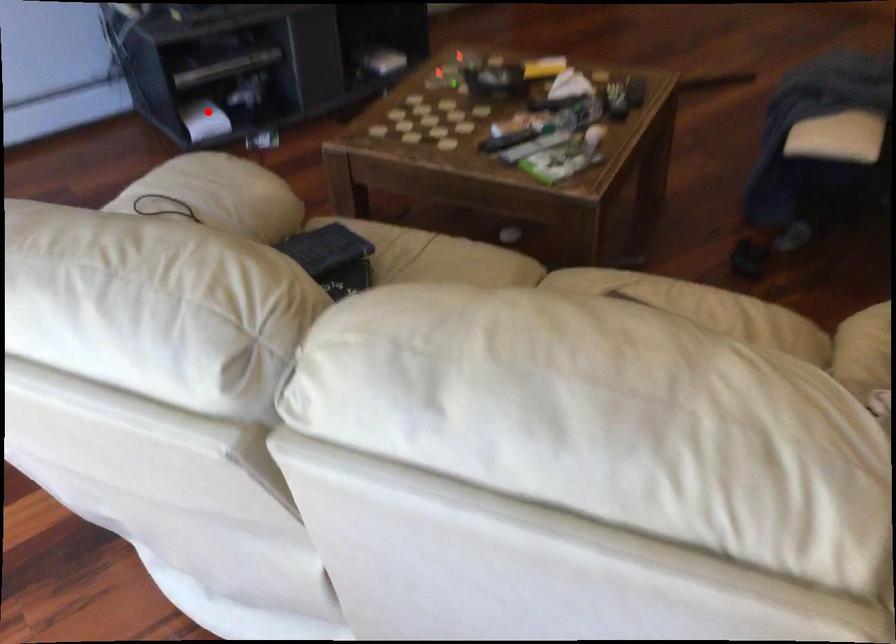
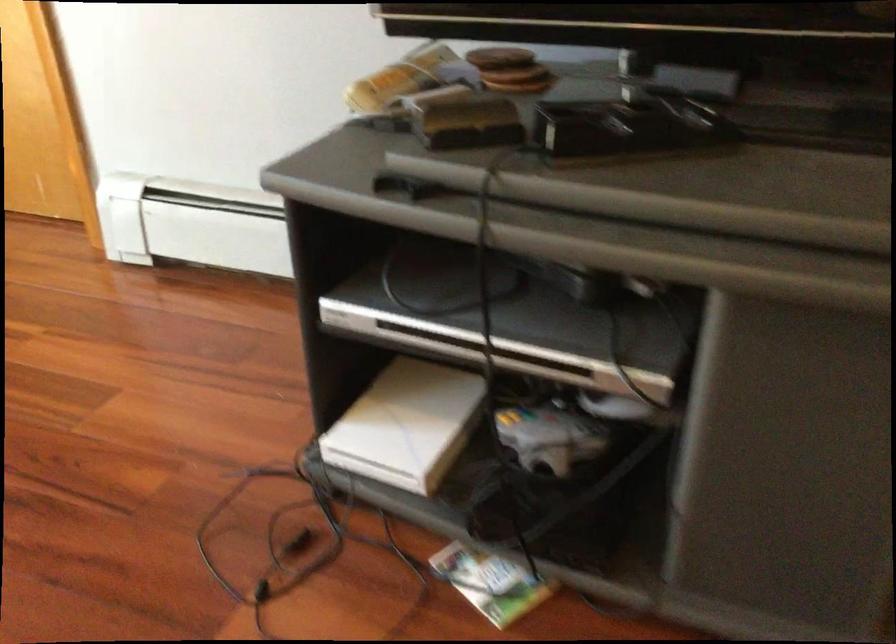
Where in the second image is the point corresponding to the highlighted location from the first image?

(407, 424)